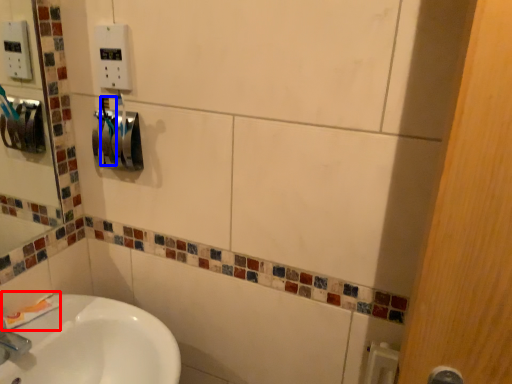
Question: Among these objects, which one is farthest to the camera, toothpaste (highlighted by a red box) or toothbrush (highlighted by a blue box)?

Choices:
 (A) toothpaste
 (B) toothbrush

Answer: (A)